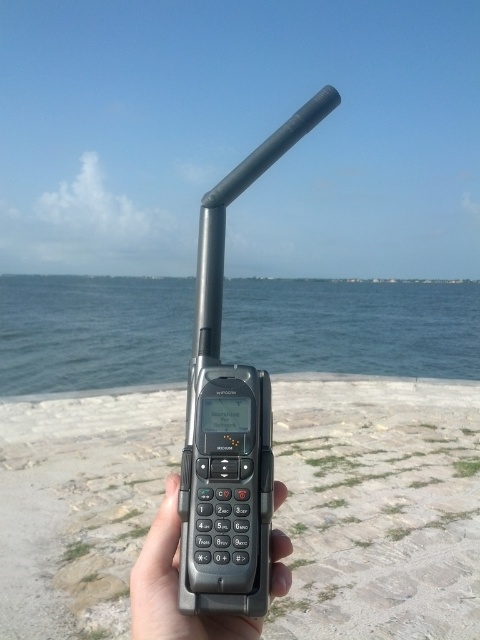
Can you confirm if blue water at center is bigger than black matte phone at center?

Yes.

Does point (328, 321) come in front of point (156, 520)?

That is False.

Find the location of a particular element. This screenshot has height=640, width=480. blue water at center is located at coordinates (352, 326).

Can you confirm if gray stone beach at center is taller than blue water at center?

No, gray stone beach at center is not taller than blue water at center.

Is point (33, 531) more distant than point (176, 348)?

That is False.

I want to click on gray stone beach at center, so click(377, 508).

Is point (35, 506) positioned behind point (180, 632)?

Yes, it is behind point (180, 632).

Which is above, gray stone beach at center or black matte phone at center?

black matte phone at center is above.

At what (x,y) coordinates should I click in order to perform the action: click on gray stone beach at center. Please return your answer as a coordinate pair (x, y). Looking at the image, I should click on (377, 508).